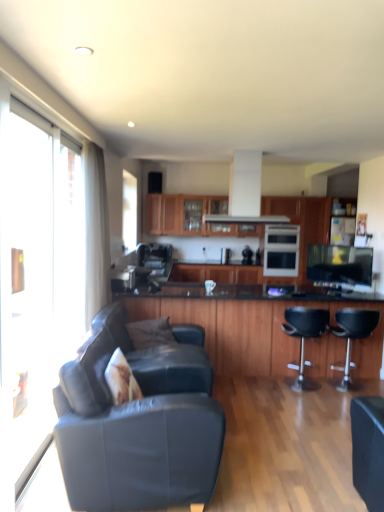
Question: Should I look upward or downward to see transparent glass window at left?

Choices:
 (A) down
 (B) up

Answer: (B)

Question: Is wooden cabinet at center, which appears as the second cabinetry when viewed from the front, to the right of black leather bar stool at center right, acting as the first chair starting from the left, from the viewer's perspective?

Choices:
 (A) yes
 (B) no

Answer: (B)

Question: From the image's perspective, is wooden cabinet at center, which appears as the second cabinetry when viewed from the front, beneath black leather bar stool at center right, acting as the first chair starting from the left?

Choices:
 (A) no
 (B) yes

Answer: (A)

Question: From a real-world perspective, is wooden cabinet at center, acting as the first cabinetry starting from the back, below black leather bar stool at center right, acting as the first chair starting from the left?

Choices:
 (A) yes
 (B) no

Answer: (B)

Question: Considering the relative positions of wooden cabinet at center, which appears as the second cabinetry when viewed from the front, and black leather bar stool at center right, placed as the 2th chair when sorted from right to left, in the image provided, is wooden cabinet at center, which appears as the second cabinetry when viewed from the front, in front of black leather bar stool at center right, placed as the 2th chair when sorted from right to left,?

Choices:
 (A) no
 (B) yes

Answer: (A)

Question: Does wooden cabinet at center, which appears as the second cabinetry when viewed from the front, touch black leather bar stool at center right, placed as the 2th chair when sorted from right to left?

Choices:
 (A) no
 (B) yes

Answer: (A)

Question: Does wooden cabinet at center, acting as the first cabinetry starting from the back, have a smaller size compared to black leather bar stool at center right, acting as the first chair starting from the left?

Choices:
 (A) yes
 (B) no

Answer: (B)

Question: From the image's perspective, is transparent glass screen door at left on transparent glass window at left?

Choices:
 (A) no
 (B) yes

Answer: (A)

Question: Is transparent glass screen door at left looking in the opposite direction of transparent glass window at left?

Choices:
 (A) yes
 (B) no

Answer: (B)

Question: Does transparent glass screen door at left lie behind transparent glass window at left?

Choices:
 (A) no
 (B) yes

Answer: (A)

Question: Considering the relative positions of transparent glass screen door at left and transparent glass window at left in the image provided, is transparent glass screen door at left to the left of transparent glass window at left from the viewer's perspective?

Choices:
 (A) no
 (B) yes

Answer: (A)

Question: From the image's perspective, is transparent glass screen door at left below transparent glass window at left?

Choices:
 (A) yes
 (B) no

Answer: (A)

Question: Considering the relative sizes of transparent glass screen door at left and transparent glass window at left in the image provided, is transparent glass screen door at left thinner than transparent glass window at left?

Choices:
 (A) yes
 (B) no

Answer: (B)

Question: Is the position of white textured pillow at lower left, placed as the first pillow when sorted from front to back, less distant than that of leather couch at lower left?

Choices:
 (A) yes
 (B) no

Answer: (B)